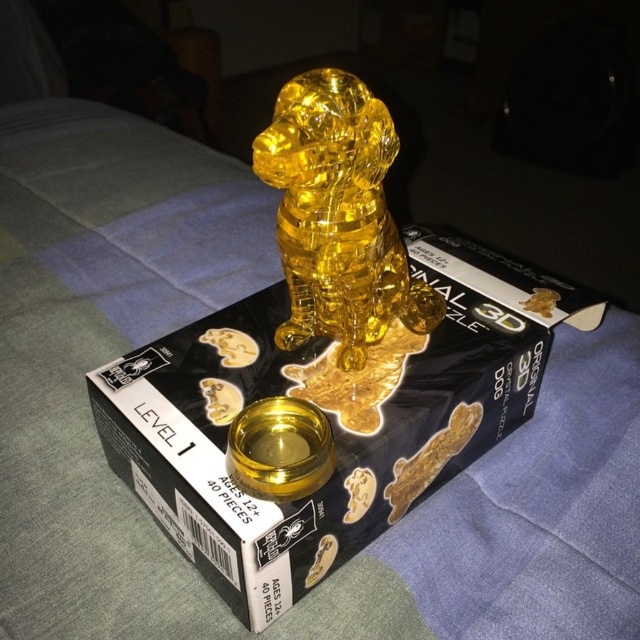
Which is behind, point (218, 385) or point (358, 125)?

Positioned behind is point (218, 385).

Between translucent yellow plastic at center and translucent yellow crystal dog at center, which one appears on the right side from the viewer's perspective?

translucent yellow plastic at center

Which is in front, point (241, 531) or point (332, 243)?

Positioned in front is point (241, 531).

The image size is (640, 640). Identify the location of translucent yellow plastic at center. (330, 417).

Which is more to the right, translucent yellow plastic at center or gold shiny bowl at center?

From the viewer's perspective, translucent yellow plastic at center appears more on the right side.

Is translucent yellow plastic at center smaller than gold shiny bowl at center?

No, translucent yellow plastic at center is not smaller than gold shiny bowl at center.

Does point (252, 520) lie in front of point (316, 468)?

Yes.

Find the location of a particular element. translucent yellow plastic at center is located at coordinates (330, 417).

Is translucent yellow crystal dog at center in front of gold shiny bowl at center?

Yes, translucent yellow crystal dog at center is in front of gold shiny bowl at center.

Between point (285, 234) and point (324, 435), which one is positioned in front?

Point (324, 435) is more forward.

The height and width of the screenshot is (640, 640). In order to click on translucent yellow crystal dog at center in this screenshot , I will do `click(339, 216)`.